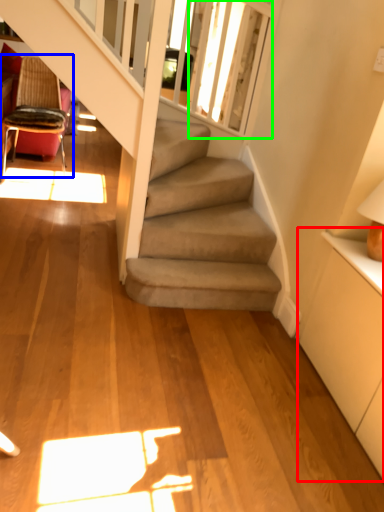
Question: Estimate the real-world distances between objects in this image. Which object is closer to dresser (highlighted by a red box), chair (highlighted by a blue box) or window screen (highlighted by a green box)?

Choices:
 (A) chair
 (B) window screen

Answer: (B)